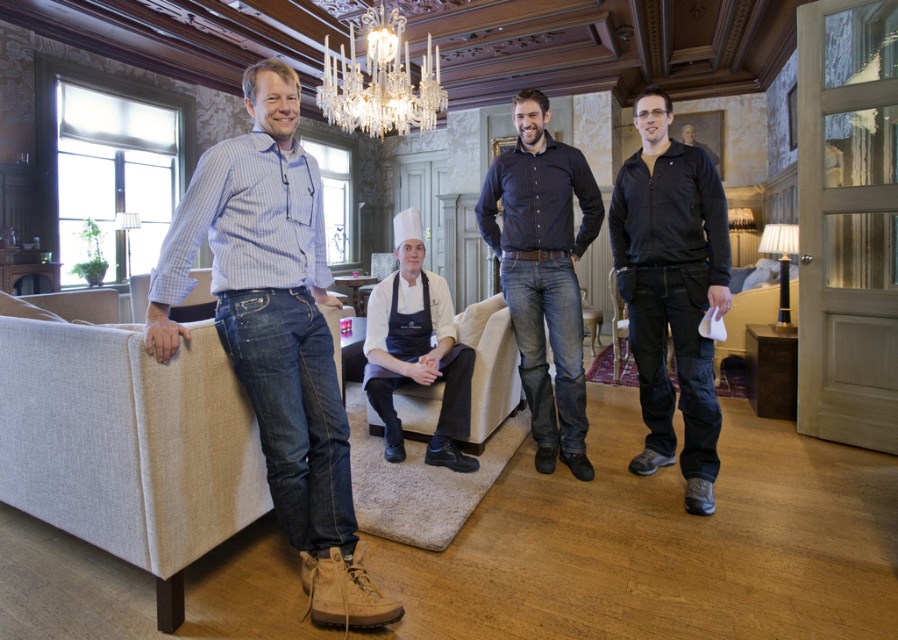
Question: Does textured beige couch at left appear over beige fabric couch at center?

Choices:
 (A) yes
 (B) no

Answer: (B)

Question: Does dark blue striped shirt at center appear under smooth black jacket at center?

Choices:
 (A) no
 (B) yes

Answer: (B)

Question: Which point appears farthest from the camera in this image?

Choices:
 (A) (478, 349)
 (B) (40, 436)
 (C) (613, 326)
 (D) (602, 317)

Answer: (D)

Question: Which point is farther to the camera?

Choices:
 (A) blue jeans at left
 (B) black fabric armchair at right

Answer: (B)

Question: Which point is closer to the camera?

Choices:
 (A) (590, 180)
 (B) (411, 262)
 (C) (617, 324)
 (D) (81, 298)

Answer: (A)

Question: Is dark blue striped shirt at center bigger than dark gray fabric armchair at center?

Choices:
 (A) yes
 (B) no

Answer: (A)